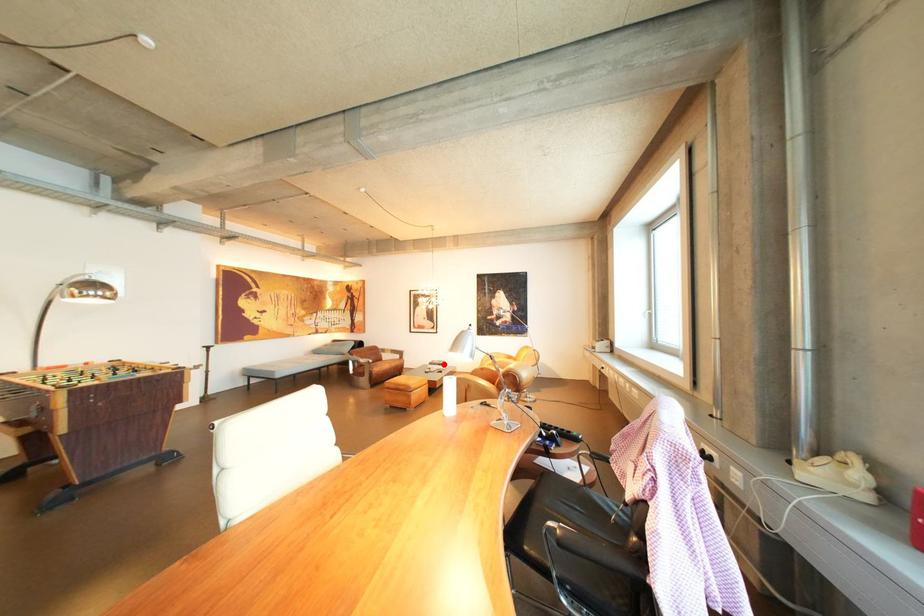
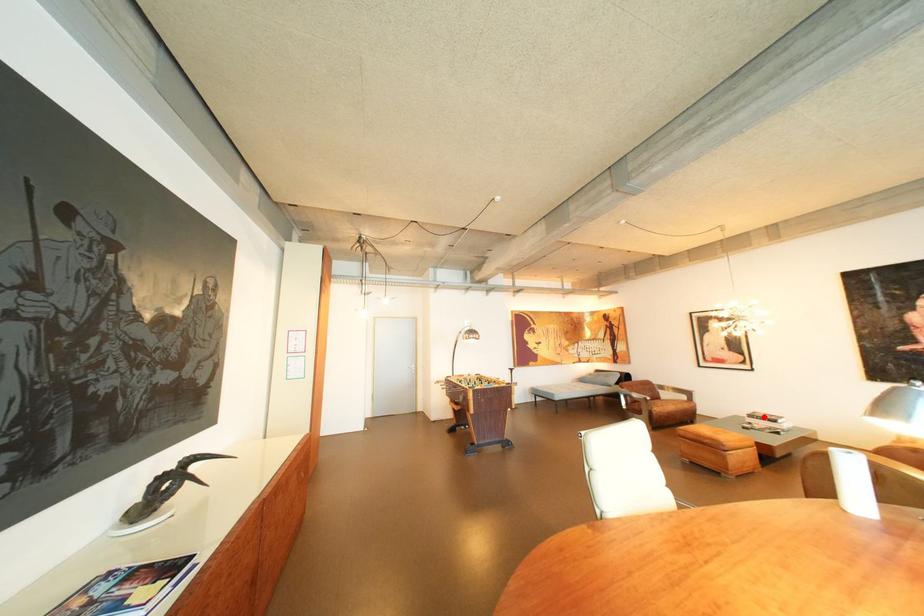
I am providing you with two images of the same scene from different viewpoints. A red point is marked on the first image and another point is marked on the second image. Do the highlighted points in image1 and image2 indicate the same real-world spot?

Yes